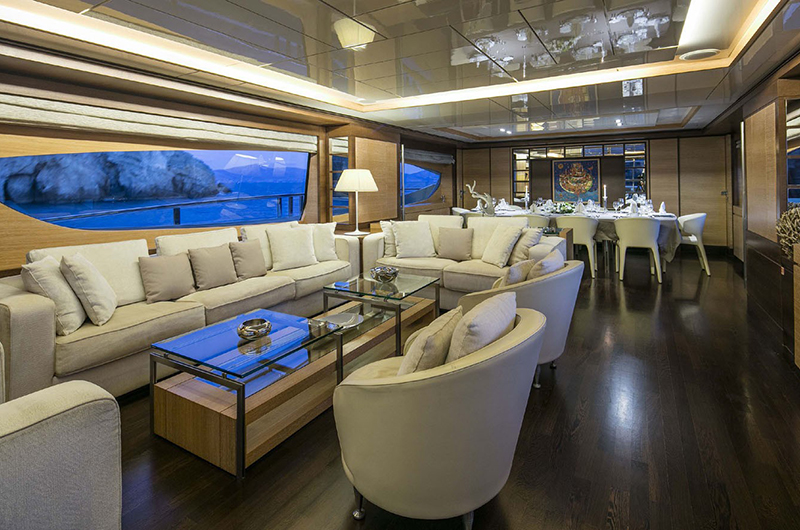
Find the location of a particular element. table is located at coordinates (244, 373).